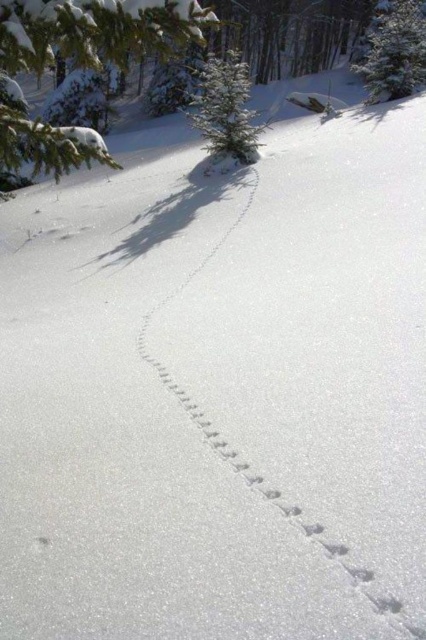
Question: Does green textured pine tree at upper right have a smaller size compared to green textured evergreen tree at center?

Choices:
 (A) no
 (B) yes

Answer: (B)

Question: Does green textured pine branch at upper left have a greater width compared to green textured pine tree at upper right?

Choices:
 (A) no
 (B) yes

Answer: (B)

Question: Is green textured pine tree at upper right to the left of green textured evergreen tree at center from the viewer's perspective?

Choices:
 (A) no
 (B) yes

Answer: (A)

Question: Which point is farther from the camera taking this photo?

Choices:
 (A) (201, 20)
 (B) (232, 129)
 (C) (405, 64)

Answer: (C)

Question: Which point is closer to the camera?

Choices:
 (A) (252, 157)
 (B) (386, 35)

Answer: (A)

Question: Which point is closer to the camera taking this photo?

Choices:
 (A) (25, 40)
 (B) (239, 113)

Answer: (A)